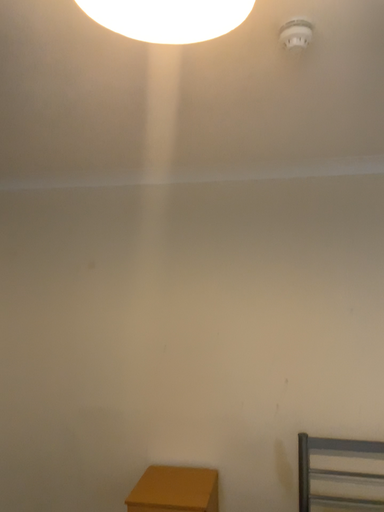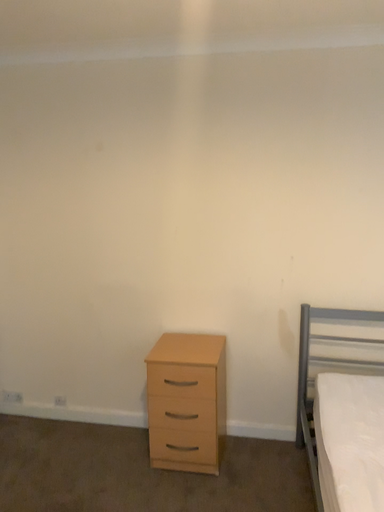
Question: How did the camera likely rotate when shooting the video?

Choices:
 (A) rotated downward
 (B) rotated upward

Answer: (A)